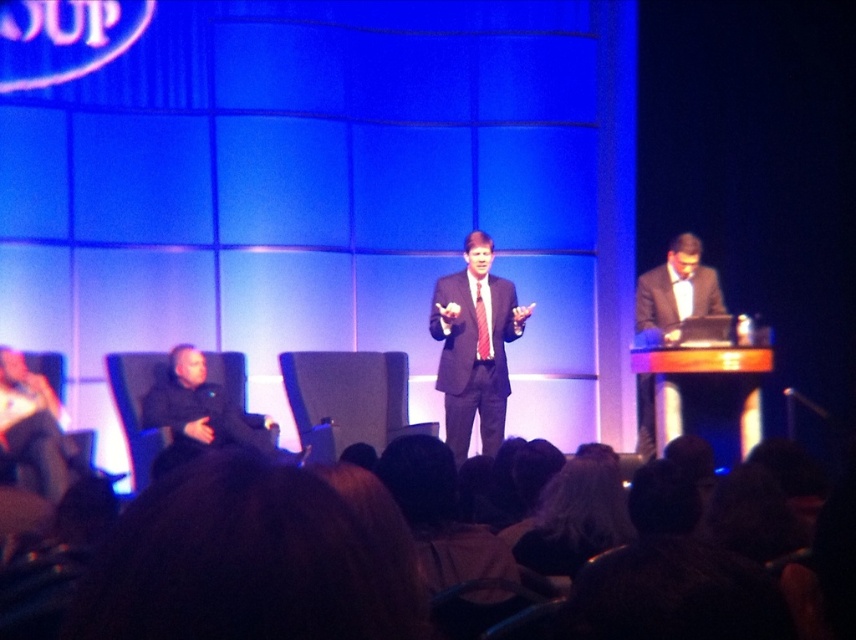
Question: Is brown hair at lower center positioned at the back of dark gray suit at center?

Choices:
 (A) yes
 (B) no

Answer: (B)

Question: Is brown hair at lower center closer to camera compared to black leather jacket at left?

Choices:
 (A) no
 (B) yes

Answer: (B)

Question: Among these objects, which one is nearest to the camera?

Choices:
 (A) brown hair at lower center
 (B) dark gray suit at center

Answer: (A)

Question: Which of the following is the closest to the observer?

Choices:
 (A) (458, 320)
 (B) (280, 449)
 (C) (52, 600)

Answer: (C)

Question: Which object is farther from the camera taking this photo?

Choices:
 (A) matte black suit at center
 (B) brown hair at lower center
 (C) black leather jacket at left

Answer: (A)

Question: Does black leather jacket at left have a larger size compared to matte black suit at center?

Choices:
 (A) no
 (B) yes

Answer: (B)